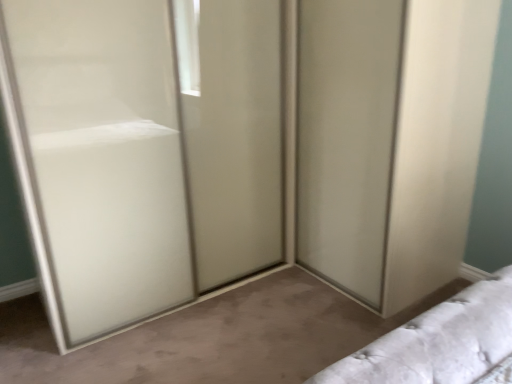
Describe the element at coordinates (98, 158) in the screenshot. This screenshot has height=384, width=512. I see `matte glass screen door at center` at that location.

Where is `matte glass screen door at center`? matte glass screen door at center is located at coordinates (98, 158).

Find the location of `matte glass screen door at center`. matte glass screen door at center is located at coordinates (98, 158).